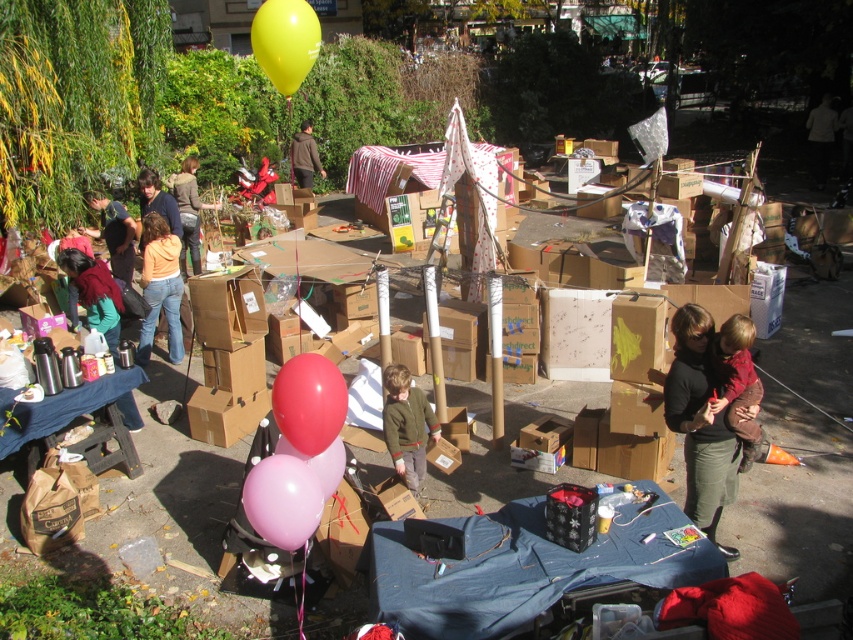
Question: Which point is closer to the camera?

Choices:
 (A) (321, 449)
 (B) (393, 422)
 (C) (320, 456)
 (D) (294, 476)

Answer: (D)

Question: Which point is closer to the camera?

Choices:
 (A) (287, 420)
 (B) (387, 445)

Answer: (A)

Question: Is brown cardboard box at center behind brown soft jacket at center?

Choices:
 (A) yes
 (B) no

Answer: (B)

Question: Which object is farther from the camera taking this photo?

Choices:
 (A) pink rubber balloon at center
 (B) green wool sweater at center
 (C) orange cotton shirt at center
 (D) yellow rubber balloon at upper center

Answer: (C)

Question: Is matte black sweater at center positioned in front of pink rubber balloon at lower center?

Choices:
 (A) no
 (B) yes

Answer: (A)

Question: Is yellow rubber balloon at upper center wider than pink rubber balloon at center?

Choices:
 (A) no
 (B) yes

Answer: (A)